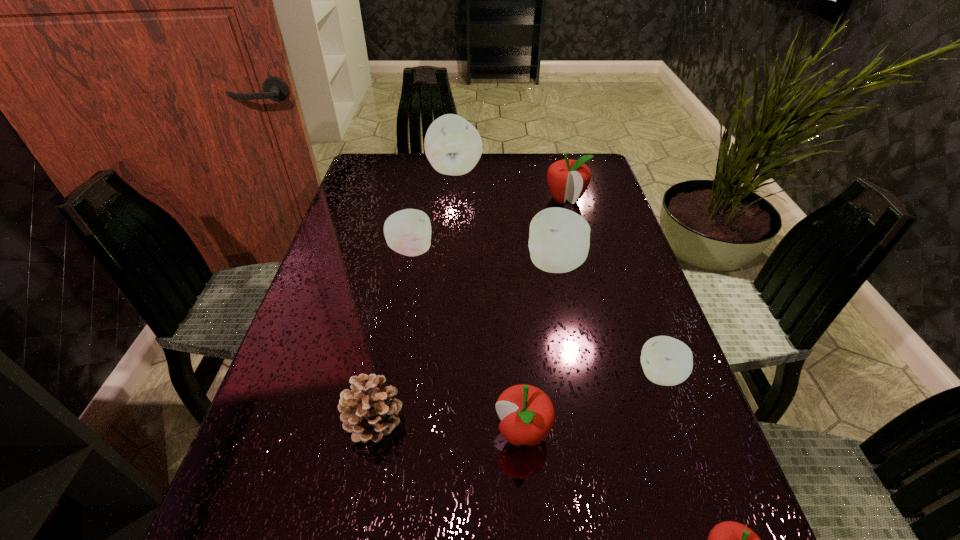
Locate an element on the screen. The image size is (960, 540). object present at the far right corner is located at coordinates (568, 179).

Locate an element on the screen. Image resolution: width=960 pixels, height=540 pixels. blank area at the left edge is located at coordinates (338, 366).

Locate an element on the screen. vacant space at the right edge of the desktop is located at coordinates (689, 427).

Image resolution: width=960 pixels, height=540 pixels. I want to click on free space between the third biggest white apple and the second white apple from right to left, so click(483, 258).

Identify the location of unoccupied position between the second smallest white apple and the tallest object. The image size is (960, 540). (433, 210).

Identify the location of empty space between the third white apple from left to right and the tallest object. (505, 217).

Find the location of `vacant space that's between the tallest object and the third biggest white apple`. vacant space that's between the tallest object and the third biggest white apple is located at coordinates (433, 210).

This screenshot has width=960, height=540. In order to click on free space that is in between the brown pinecone and the third smallest white apple in this screenshot , I will do `click(465, 342)`.

I want to click on unoccupied position between the third smallest white apple and the tallest object, so click(x=505, y=217).

Locate an element on the screen. object that stands as the sixth closest to the nearest white apple is located at coordinates (568, 179).